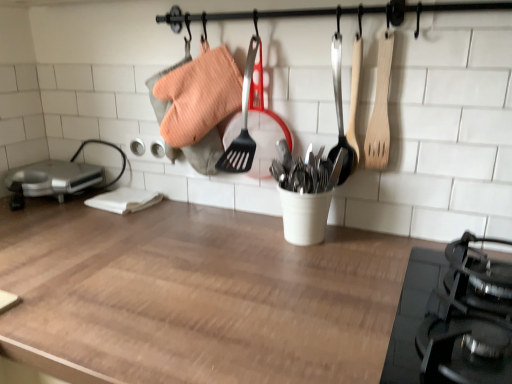
Question: Is metallic silver appliance at left to the right of wooden spatula at upper right from the viewer's perspective?

Choices:
 (A) no
 (B) yes

Answer: (A)

Question: From a real-world perspective, is metallic silver appliance at left under wooden spatula at upper right?

Choices:
 (A) yes
 (B) no

Answer: (A)

Question: Considering the relative sizes of metallic silver appliance at left and wooden spatula at upper right in the image provided, is metallic silver appliance at left thinner than wooden spatula at upper right?

Choices:
 (A) yes
 (B) no

Answer: (B)

Question: Can you confirm if metallic silver appliance at left is bigger than wooden spatula at upper right?

Choices:
 (A) no
 (B) yes

Answer: (B)

Question: Does metallic silver appliance at left come behind wooden spatula at upper right?

Choices:
 (A) no
 (B) yes

Answer: (B)

Question: Considering the relative positions of metallic silver appliance at left and wooden spoon at upper right in the image provided, is metallic silver appliance at left to the left or to the right of wooden spoon at upper right?

Choices:
 (A) right
 (B) left

Answer: (B)

Question: Is metallic silver appliance at left inside the boundaries of wooden spoon at upper right, or outside?

Choices:
 (A) inside
 (B) outside

Answer: (B)

Question: From a real-world perspective, is metallic silver appliance at left above or below wooden spoon at upper right?

Choices:
 (A) below
 (B) above

Answer: (A)

Question: In terms of width, does metallic silver appliance at left look wider or thinner when compared to wooden spoon at upper right?

Choices:
 (A) thin
 (B) wide

Answer: (B)

Question: From their relative heights in the image, would you say wooden spatula at upper right is taller or shorter than metallic silver appliance at left?

Choices:
 (A) short
 (B) tall

Answer: (B)

Question: From a real-world perspective, is wooden spatula at upper right above or below metallic silver appliance at left?

Choices:
 (A) above
 (B) below

Answer: (A)

Question: From the image's perspective, is wooden spatula at upper right above or below metallic silver appliance at left?

Choices:
 (A) above
 (B) below

Answer: (A)

Question: Is point (376, 97) closer or farther from the camera than point (13, 198)?

Choices:
 (A) closer
 (B) farther

Answer: (A)

Question: In terms of height, does metallic silver appliance at left look taller or shorter compared to wooden at center?

Choices:
 (A) short
 (B) tall

Answer: (A)

Question: In terms of size, does metallic silver appliance at left appear bigger or smaller than wooden at center?

Choices:
 (A) small
 (B) big

Answer: (A)